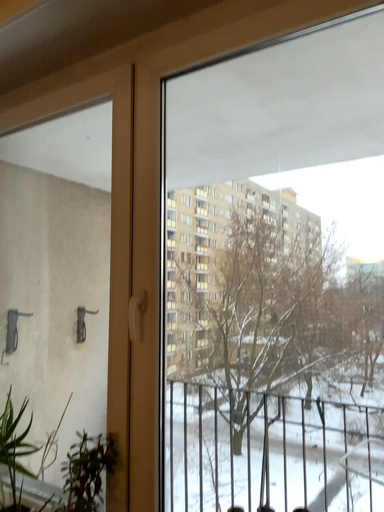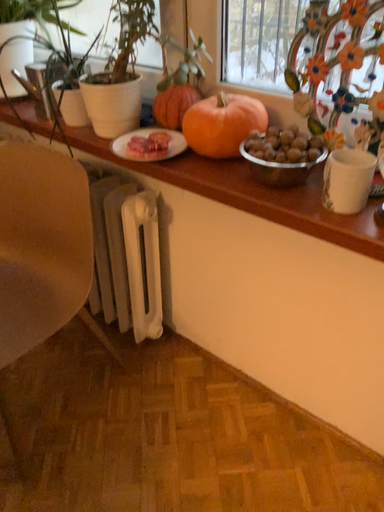
Question: How did the camera likely rotate when shooting the video?

Choices:
 (A) rotated right
 (B) rotated left

Answer: (B)